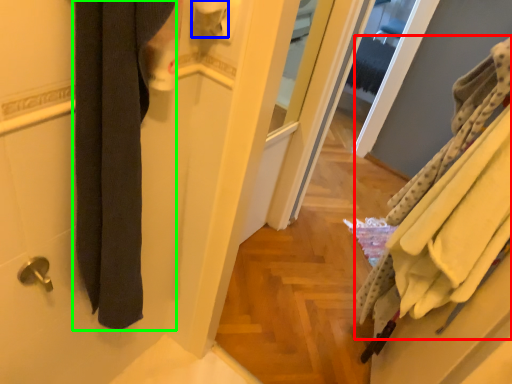
Question: Which is farther away from bath towel (highlighted by a red box)? toilet paper (highlighted by a blue box) or bath towel (highlighted by a green box)?

Choices:
 (A) toilet paper
 (B) bath towel

Answer: (B)